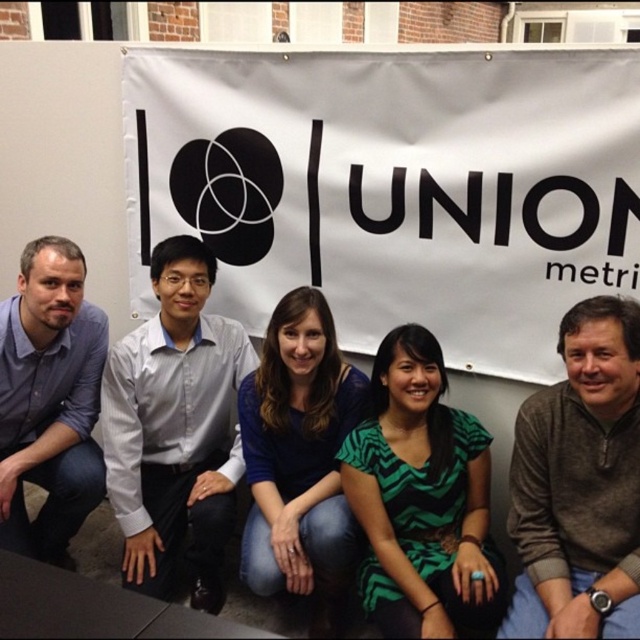
Does point (573, 403) lie behind point (454, 458)?

No, (573, 403) is in front of (454, 458).

Image resolution: width=640 pixels, height=640 pixels. What are the coordinates of `brown sweater at right` in the screenshot? It's located at (579, 483).

Is point (604, 417) positioned after point (444, 518)?

No.

Locate an element on the screen. The width and height of the screenshot is (640, 640). brown sweater at right is located at coordinates (579, 483).

Is point (394, 358) behind point (26, 545)?

No, it is not.

Is green zigzag dress at center closer to the viewer compared to blue shirt at left?

Yes, green zigzag dress at center is in front of blue shirt at left.

Which is behind, point (390, 584) or point (26, 452)?

The point (26, 452) is behind.

Locate an element on the screen. This screenshot has height=640, width=640. green zigzag dress at center is located at coordinates (420, 497).

Based on the photo, can you confirm if green zigzag dress at center is thinner than blue fabric shirt at center?

Incorrect, green zigzag dress at center's width is not less than blue fabric shirt at center's.

Is point (368, 518) positioned before point (298, 385)?

Yes, it is.

Locate an element on the screen. The width and height of the screenshot is (640, 640). green zigzag dress at center is located at coordinates (420, 497).